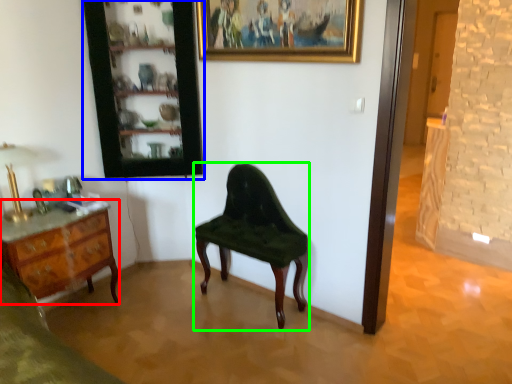
Question: Estimate the real-world distances between objects in this image. Which object is closer to desk (highlighted by a red box), cabinetry (highlighted by a blue box) or chair (highlighted by a green box)?

Choices:
 (A) cabinetry
 (B) chair

Answer: (A)